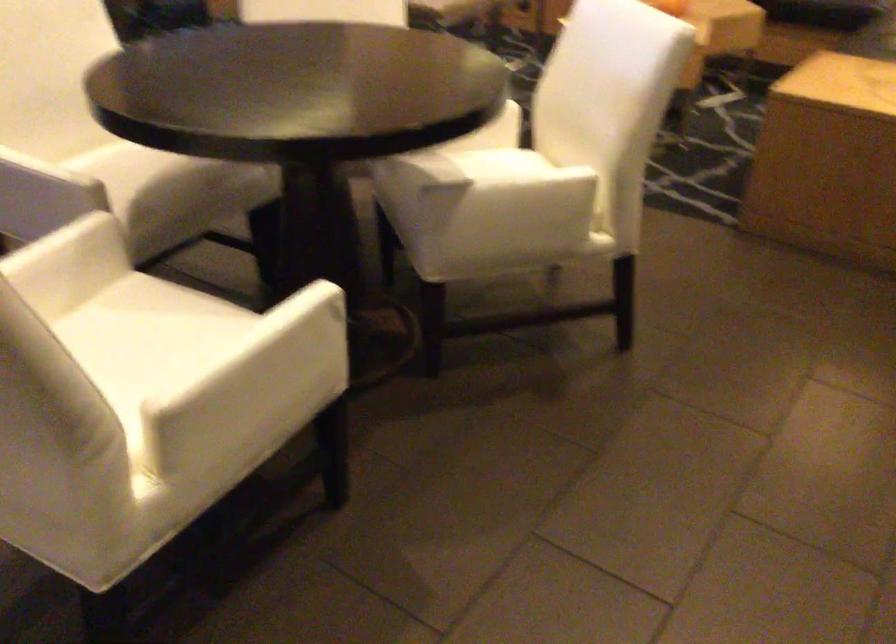
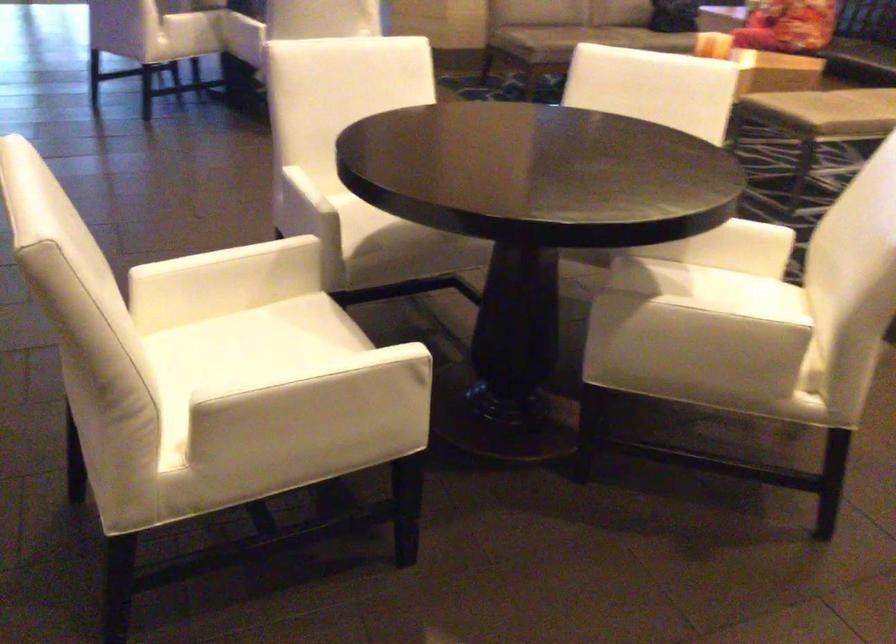
Locate, in the second image, the point that corresponds to pixel 240 343 in the first image.

(300, 373)